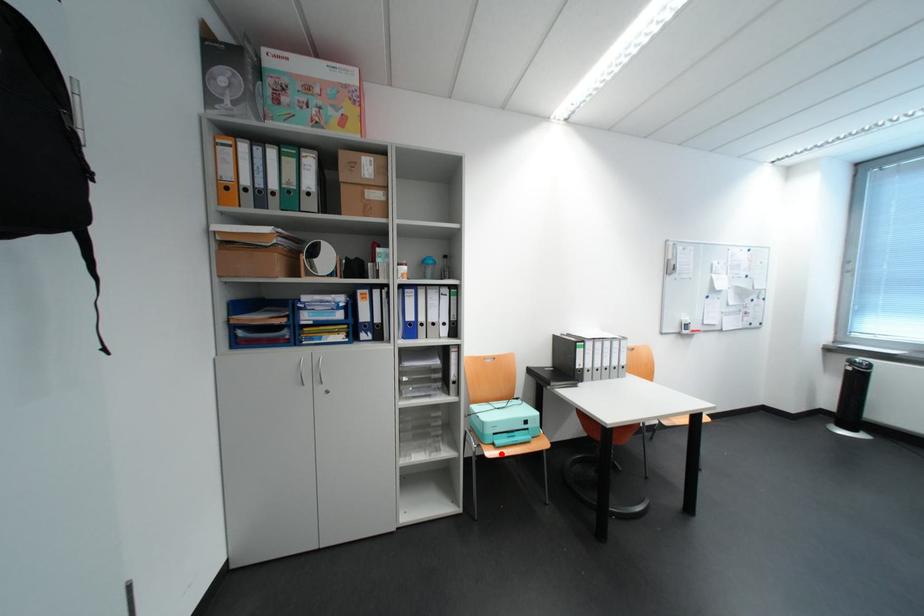
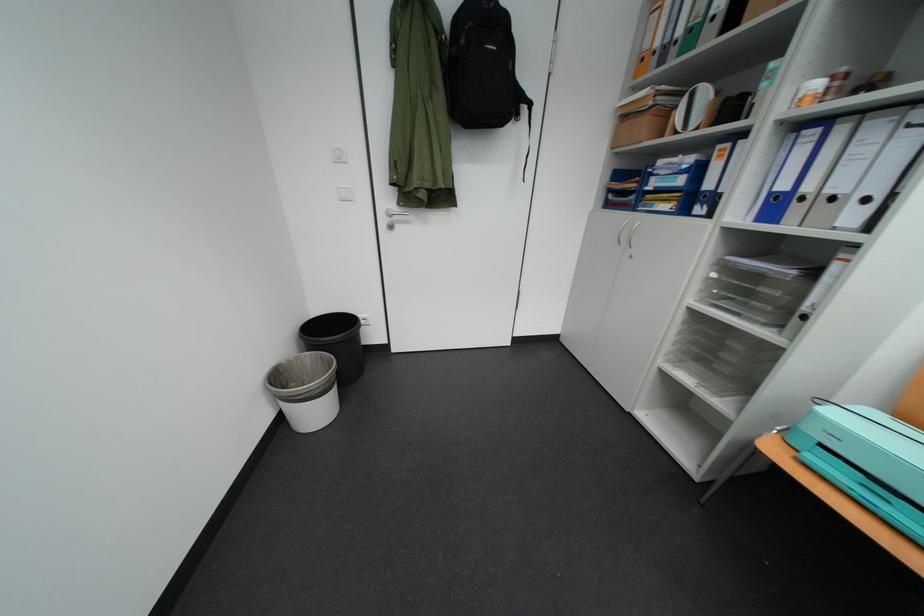
Question: I am providing you with two images of the same scene from different viewpoints. In image1, a red point is highlighted. Considering the same 3D point in image2, which of the following is correct?

Choices:
 (A) It is closer
 (B) It is farther

Answer: (A)